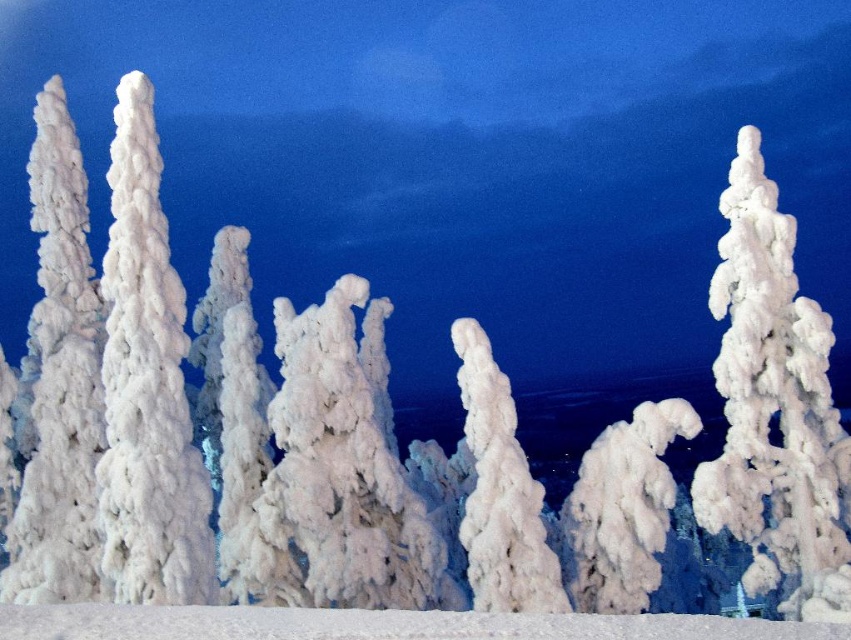
Between white fluffy tree at left and white fluffy tree at center, which one appears on the left side from the viewer's perspective?

From the viewer's perspective, white fluffy tree at left appears more on the left side.

Does point (46, 364) come farther from viewer compared to point (575, 493)?

Yes, it is.

Locate an element on the screen. white fluffy tree at left is located at coordinates (58, 380).

Who is positioned more to the left, white fluffy snow at center or white fluffy tree at left?

white fluffy tree at left is more to the left.

Can you confirm if white fluffy snow at center is wider than white fluffy tree at left?

Yes.

Is point (730, 348) farther from viewer compared to point (21, 484)?

No, it is in front of (21, 484).

Where is `white fluffy snow at center`? The image size is (851, 640). white fluffy snow at center is located at coordinates (774, 406).

From the picture: Is white fluffy snow at center thinner than frosted white tree at center?

No, white fluffy snow at center is not thinner than frosted white tree at center.

Who is taller, white fluffy snow at center or frosted white tree at center?

Standing taller between the two is white fluffy snow at center.

The image size is (851, 640). I want to click on white fluffy snow at center, so click(774, 406).